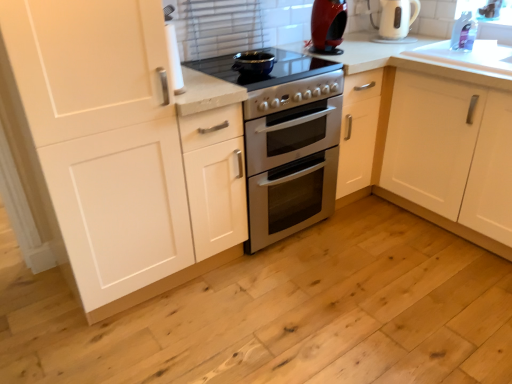
This screenshot has height=384, width=512. Find the location of `vacant space in front of white glossy electric kettle at upper right`. vacant space in front of white glossy electric kettle at upper right is located at coordinates (409, 45).